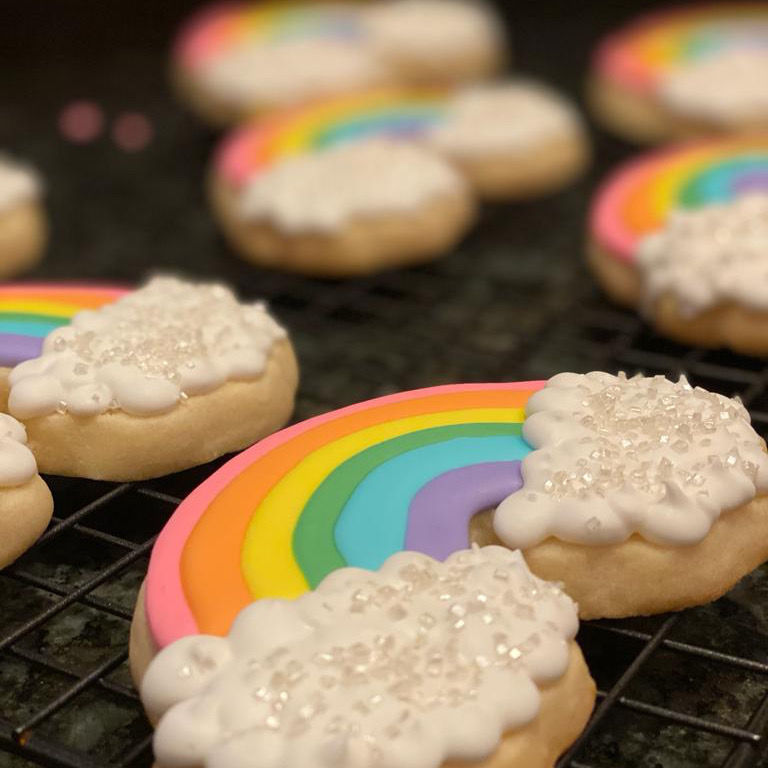
Locate an element on the screen. cooling rack is located at coordinates (650, 634).